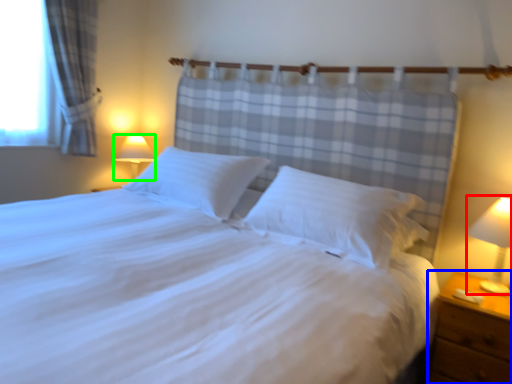
Question: Which is nearer to the bedside lamp (highlighted by a red box)? nightstand (highlighted by a blue box) or lamp (highlighted by a green box).

Choices:
 (A) nightstand
 (B) lamp

Answer: (A)